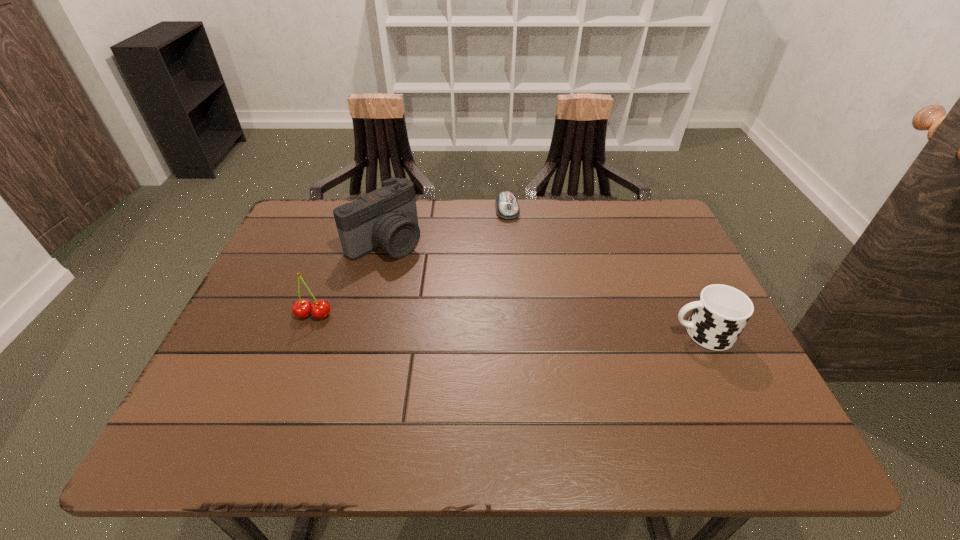
You are a GUI agent. You are given a task and a screenshot of the screen. Output one action in this format:
    pyautogui.click(x=<x>, y=<y>)
    Task: Click on the vacant region at the near edge
    
    Given the screenshot: What is the action you would take?
    pyautogui.click(x=493, y=380)

This screenshot has width=960, height=540. In order to click on vacant space at the left edge in this screenshot , I will do `click(280, 297)`.

I want to click on vacant space at the right edge of the desktop, so click(666, 269).

Locate an element on the screen. free point at the far left corner is located at coordinates (284, 238).

The image size is (960, 540). Find the location of `free region at the far right corner of the desktop`. free region at the far right corner of the desktop is located at coordinates (652, 246).

Find the location of `vacant space in between the cherry and the second object from right to left`. vacant space in between the cherry and the second object from right to left is located at coordinates (411, 262).

At what (x,y) coordinates should I click in order to perform the action: click on vacant point located between the cherry and the shortest object. Please return your answer as a coordinate pair (x, y). Looking at the image, I should click on (411, 262).

Where is `unoccupied area between the camera and the rightmost object`? The image size is (960, 540). unoccupied area between the camera and the rightmost object is located at coordinates (544, 287).

You are a GUI agent. You are given a task and a screenshot of the screen. Output one action in this format:
    pyautogui.click(x=<x>, y=<y>)
    Task: Click on the vacant area between the cherry and the camera
    This screenshot has width=960, height=540.
    Given the screenshot: What is the action you would take?
    pyautogui.click(x=349, y=278)

You are a GUI agent. You are given a task and a screenshot of the screen. Output one action in this format:
    pyautogui.click(x=<x>, y=<y>)
    Task: Click on the unoccupied area between the second object from right to left and the tallest object
    The image size is (960, 540).
    Given the screenshot: What is the action you would take?
    pyautogui.click(x=446, y=225)